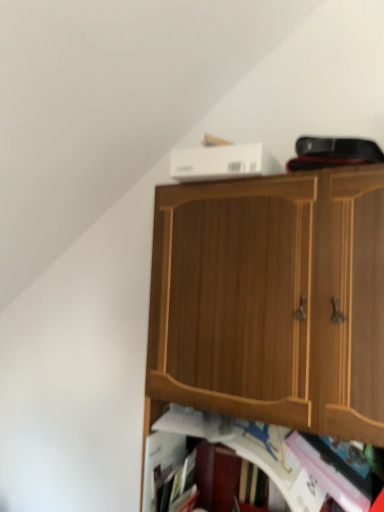
The image size is (384, 512). I want to click on wooden cabinet at center, so click(x=271, y=301).

The image size is (384, 512). What do you see at coordinates (271, 301) in the screenshot?
I see `wooden cabinet at center` at bounding box center [271, 301].

Where is `wooden cabinet at center`? The height and width of the screenshot is (512, 384). wooden cabinet at center is located at coordinates (271, 301).